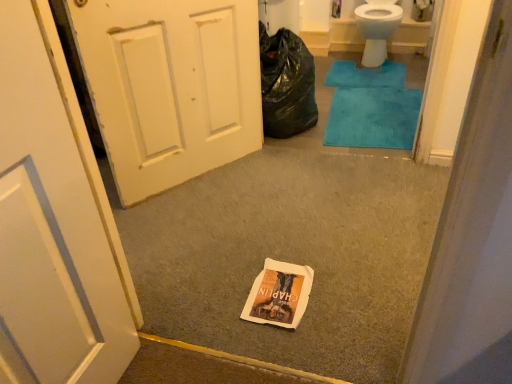
Where is `free region under white paper bag at center (from a real-world perspective)`? The width and height of the screenshot is (512, 384). free region under white paper bag at center (from a real-world perspective) is located at coordinates (278, 292).